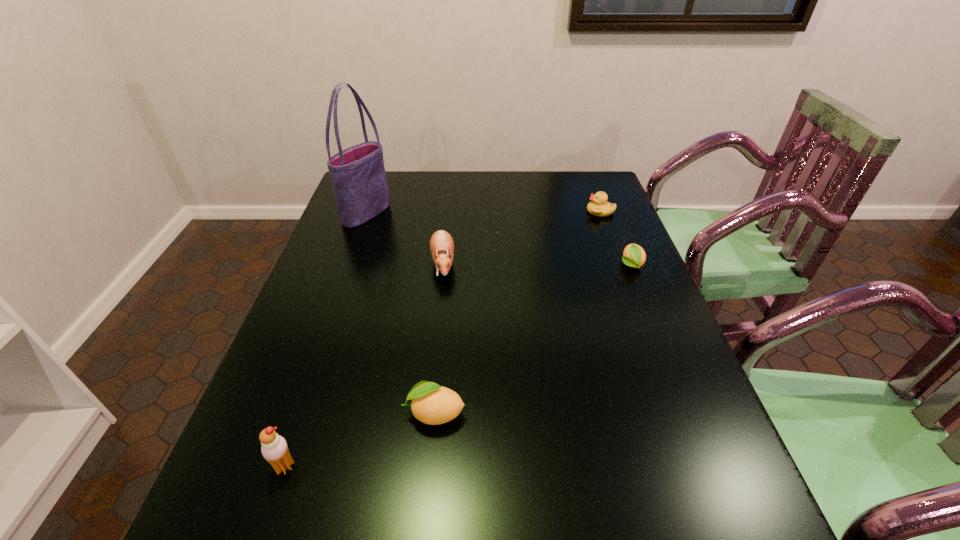
You are a GUI agent. You are given a task and a screenshot of the screen. Output one action in this format:
    pyautogui.click(x=<x>, y=<y>)
    Task: Click on the vacant space at the left edge
    
    Given the screenshot: What is the action you would take?
    pyautogui.click(x=321, y=306)

Find the location of a particular element. This screenshot has height=540, width=960. vacant space at the right edge of the desktop is located at coordinates (619, 254).

Where is `free region at the near left corner of the desktop`? This screenshot has width=960, height=540. free region at the near left corner of the desktop is located at coordinates (252, 437).

At what (x,y) coordinates should I click in order to perform the action: click on free region at the near right corner of the desktop. Please return your answer as a coordinate pair (x, y). Looking at the image, I should click on (667, 457).

Locate an element on the screen. vacant area between the duckling and the hamster is located at coordinates (521, 238).

Find the location of a particular element. The width and height of the screenshot is (960, 540). unoccupied area between the hamster and the shorter lemon is located at coordinates (537, 264).

Where is `vacant space that's between the right lemon and the second nearest object`? vacant space that's between the right lemon and the second nearest object is located at coordinates (533, 339).

Where is `free area in between the tote bag and the nearer lemon`? Image resolution: width=960 pixels, height=540 pixels. free area in between the tote bag and the nearer lemon is located at coordinates (400, 313).

You are a GUI agent. You are given a task and a screenshot of the screen. Output one action in this format:
    pyautogui.click(x=<x>, y=<y>)
    Task: Click on the free space between the left lemon and the duckling
    Image resolution: width=960 pixels, height=540 pixels.
    Given the screenshot: What is the action you would take?
    pyautogui.click(x=517, y=312)

Locate an element on the screen. Image resolution: width=960 pixels, height=540 pixels. free space that is in between the right lemon and the fifth shortest object is located at coordinates 458,366.